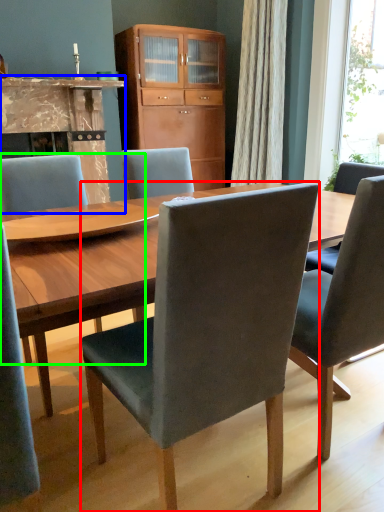
Question: Which object is positioned closest to chair (highlighted by a red box)? Select from fireplace (highlighted by a blue box) and chair (highlighted by a green box).

Choices:
 (A) fireplace
 (B) chair

Answer: (B)